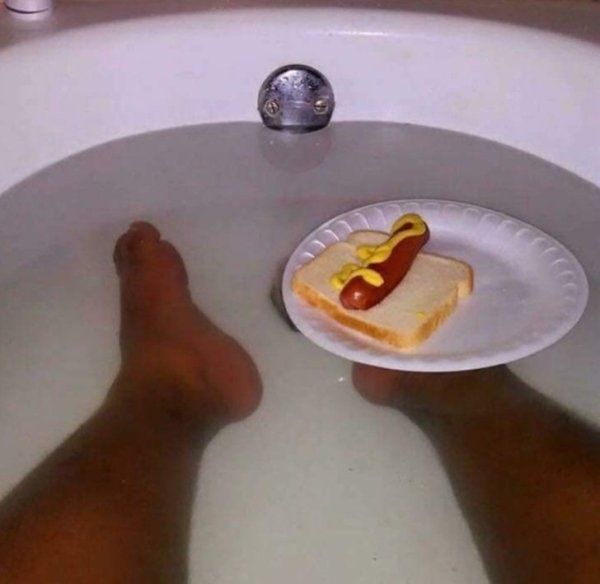
This screenshot has width=600, height=584. Identify the location of plate. (491, 331).